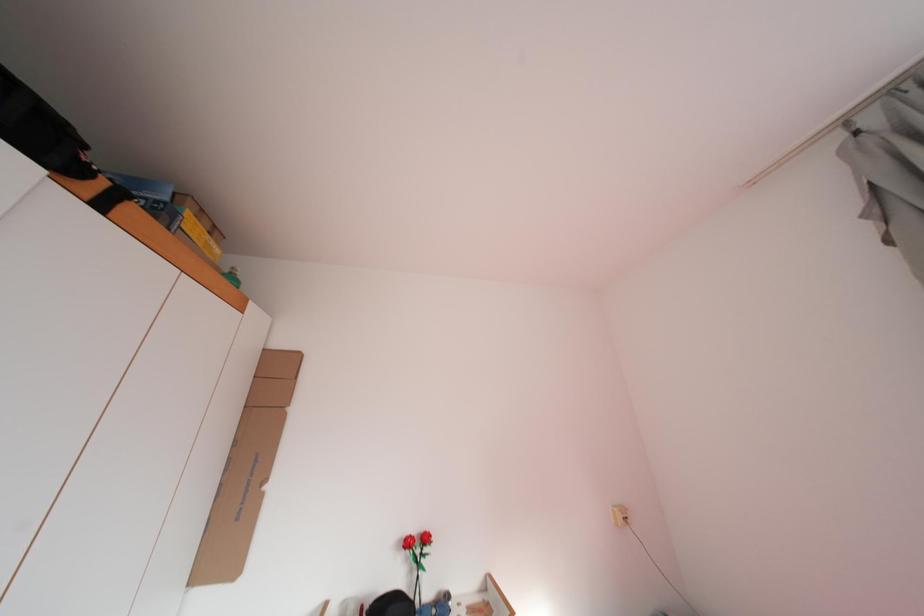
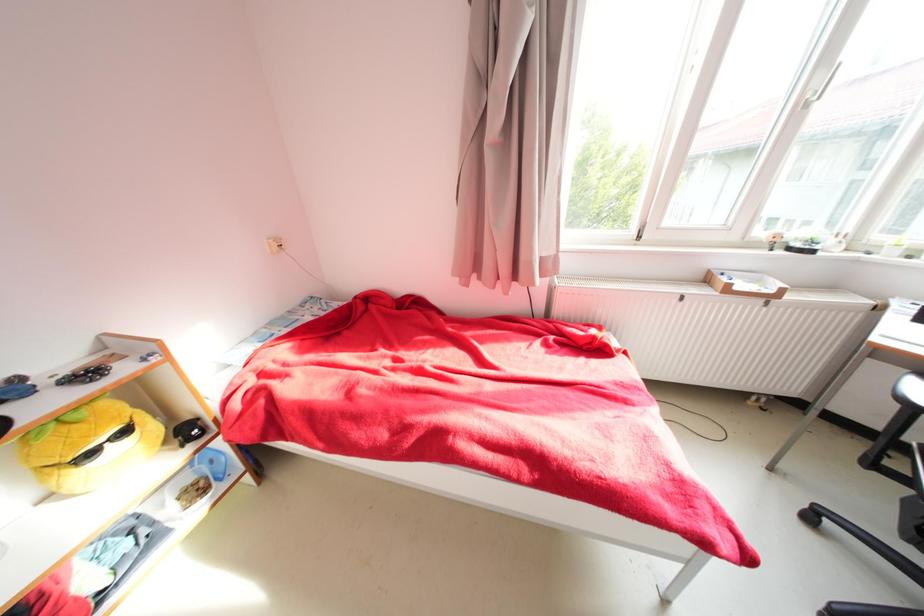
First-person continuous shooting, in which direction is the camera rotating?

The rotation direction of the camera is right-down.